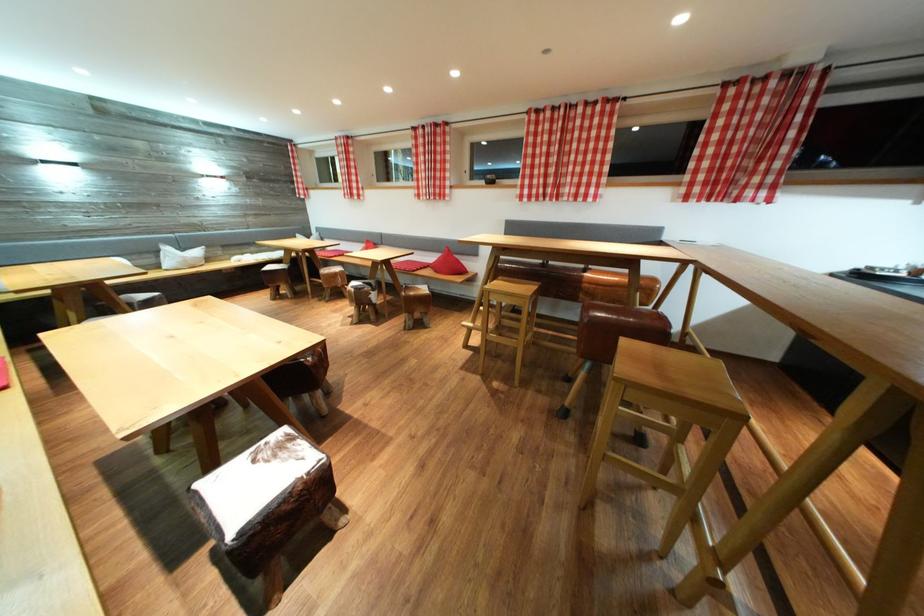
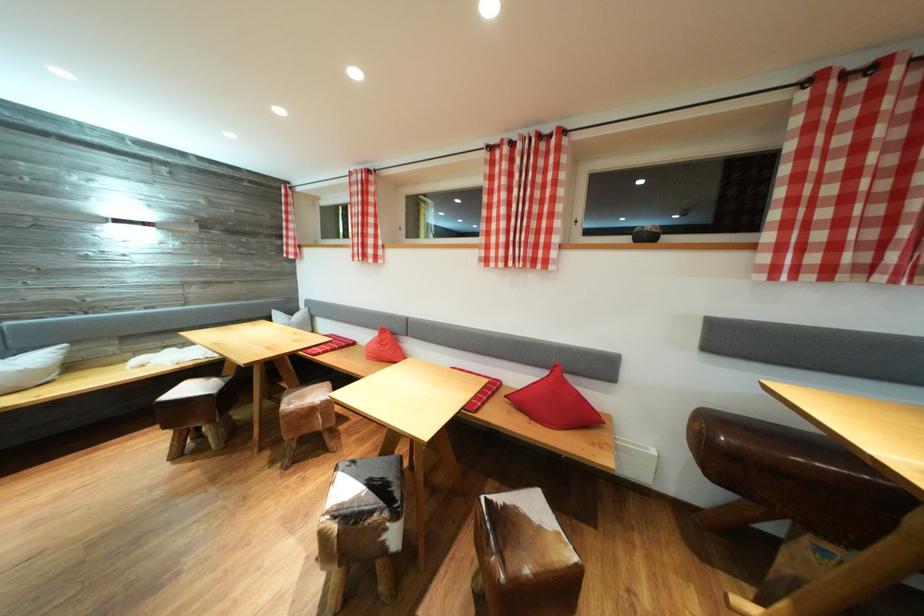
In the second image, find the point that corresponds to point (286, 293) in the first image.

(203, 434)